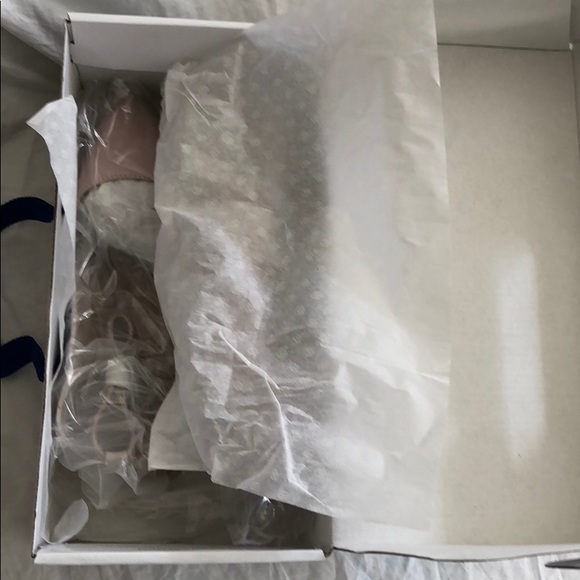
You are a GUI agent. You are given a task and a screenshot of the screen. Output one action in this format:
    pyautogui.click(x=<x>, y=<y>)
    Task: Click on the shoe box
    
    Given the screenshot: What is the action you would take?
    (x=527, y=263)